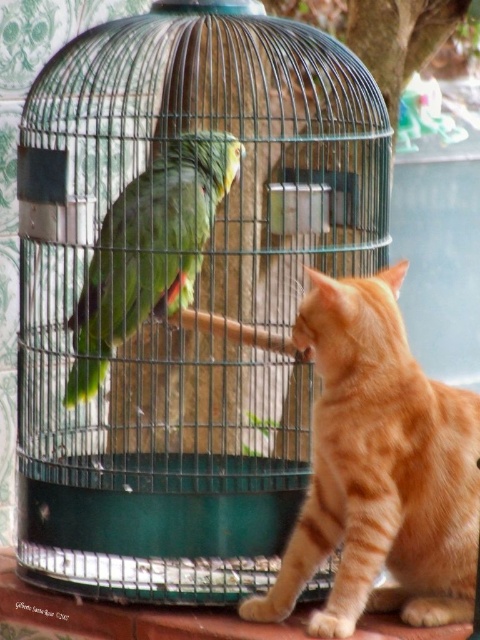
Question: Is orange tabby cat at right to the left of green matte parrot at center from the viewer's perspective?

Choices:
 (A) yes
 (B) no

Answer: (B)

Question: Is orange tabby cat at right bigger than green matte parrot at center?

Choices:
 (A) yes
 (B) no

Answer: (A)

Question: Is orange tabby cat at right to the right of green matte parrot at center from the viewer's perspective?

Choices:
 (A) no
 (B) yes

Answer: (B)

Question: Which of the following is the farthest from the observer?

Choices:
 (A) (120, 326)
 (B) (428, 401)

Answer: (A)